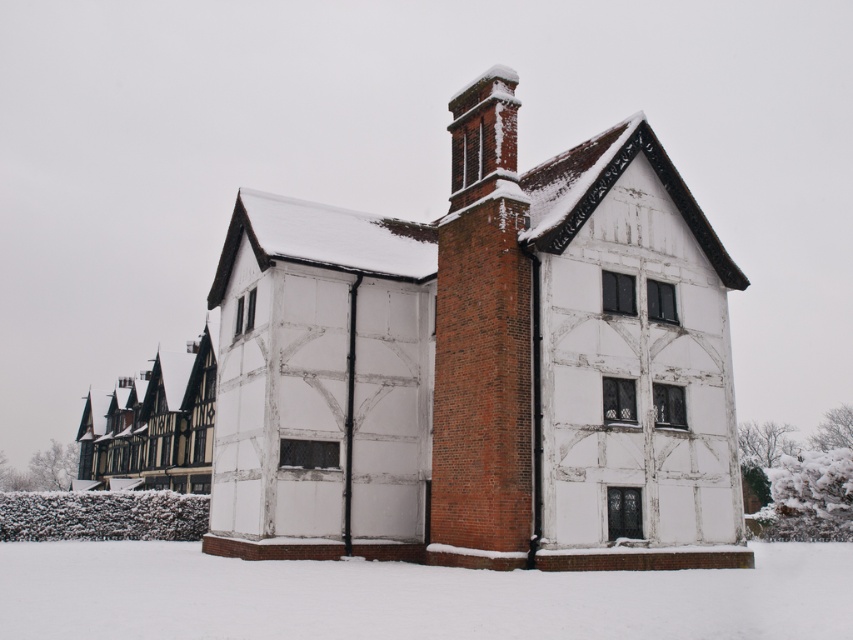
You are standing in front of the traditional half timbered house and want to take a photo of the white powdery snow at lower center and the red brick chimney at upper center. Which object will appear larger in the photo?

The white powdery snow at lower center will appear larger in the photo because it is closer to the viewer than the red brick chimney at upper center.

Looking at this image, you are standing in front of the traditional half timbered house and want to know if the white powdery snow at lower center is under the red brick chimney at upper center. Is this true?

Yes, the white powdery snow at lower center is located below red brick chimney at upper center, so it is indeed under it.

You are standing in front of the traditional half timbered house and see two points marked in the image. The first point is at coordinates point (213, 632) and the second is at point (514, 144). Which point is closer to you?

Point (213, 632) is in front of point (514, 144), so the first point is closer to you.